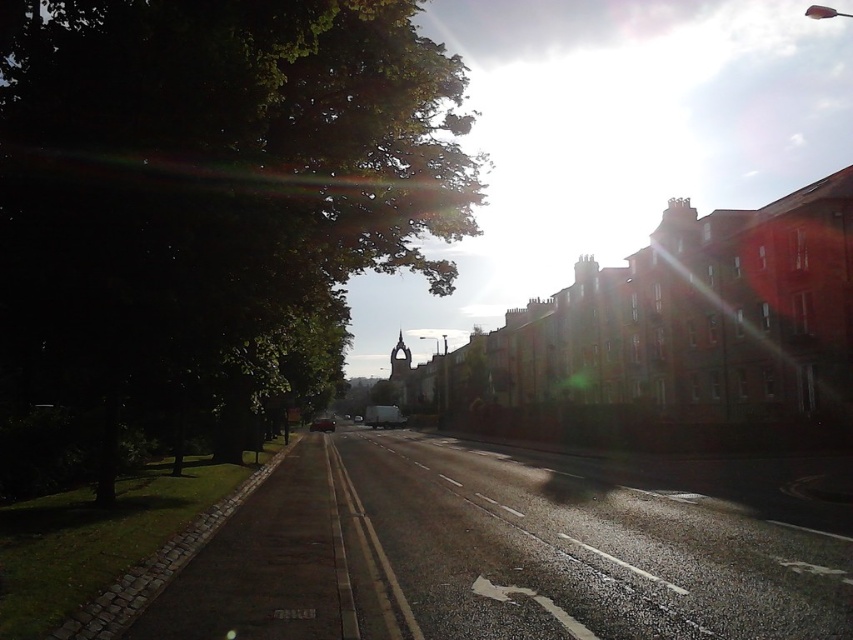
Which is more to the left, metallic silver car at center or metallic silver van at center?

From the viewer's perspective, metallic silver van at center appears more on the left side.

Which is above, metallic silver car at center or metallic silver van at center?

metallic silver car at center is higher up.

Identify the location of metallic silver car at center. The image size is (853, 640). (383, 417).

From the picture: Between green leafy tree at left and metallic silver car at center, which one has more height?

Standing taller between the two is green leafy tree at left.

What do you see at coordinates (206, 214) in the screenshot? The image size is (853, 640). I see `green leafy tree at left` at bounding box center [206, 214].

Where is `green leafy tree at left`? green leafy tree at left is located at coordinates click(206, 214).

Can you confirm if metallic silver van at center is shorter than shiny silver car at center?

Yes.

This screenshot has height=640, width=853. What are the coordinates of `metallic silver van at center` in the screenshot? It's located at (357, 419).

Between point (354, 422) and point (343, 413), which one is positioned in front?

Positioned in front is point (354, 422).

The image size is (853, 640). In order to click on metallic silver van at center in this screenshot , I will do `click(357, 419)`.